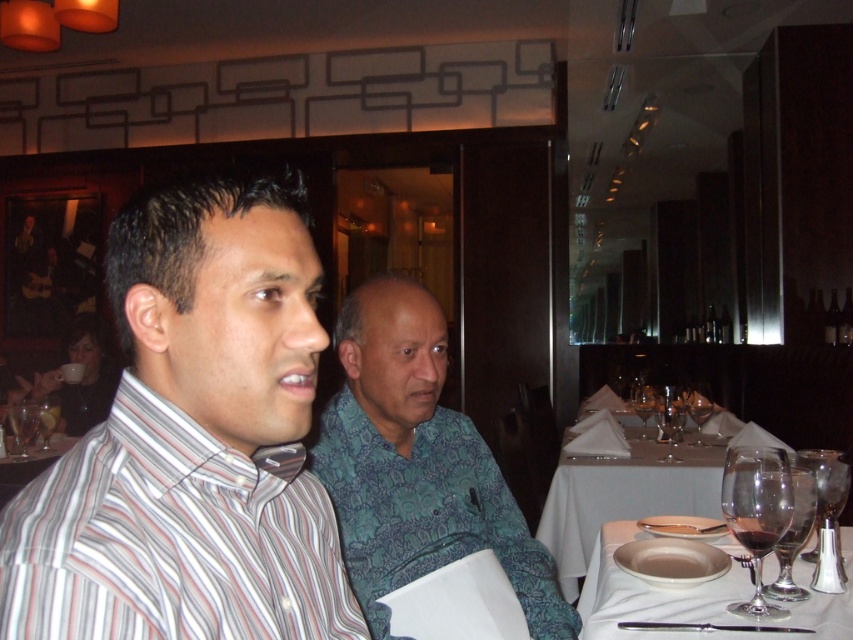
Is point (808, 499) closer to camera compared to point (701, 400)?

Yes, it is.

Is point (799, 595) positioned behind point (699, 429)?

No, (799, 595) is closer to viewer.

The width and height of the screenshot is (853, 640). What are the coordinates of `transparent glass wine glass at lower right` in the screenshot? It's located at (793, 536).

Between clear glass wine glass at right and transparent glass at left, which one has more height?

Standing taller between the two is clear glass wine glass at right.

Based on the photo, is clear glass wine glass at right smaller than transparent glass at left?

Correct, clear glass wine glass at right occupies less space than transparent glass at left.

Which is in front, point (820, 484) or point (19, 403)?

Point (820, 484)

At what (x,y) coordinates should I click in order to perform the action: click on clear glass wine glass at right. Please return your answer as a coordinate pair (x, y). Looking at the image, I should click on (827, 492).

Looking at this image, can you confirm if clear glass wine glass at right is bigger than transparent glass wine glass at center?

No, clear glass wine glass at right is not bigger than transparent glass wine glass at center.

Between clear glass wine glass at right and transparent glass wine glass at center, which one is positioned lower?

transparent glass wine glass at center is lower down.

Between point (833, 513) and point (703, 385), which one is positioned in front?

Point (833, 513) is in front.

The height and width of the screenshot is (640, 853). I want to click on clear glass wine glass at right, so tap(827, 492).